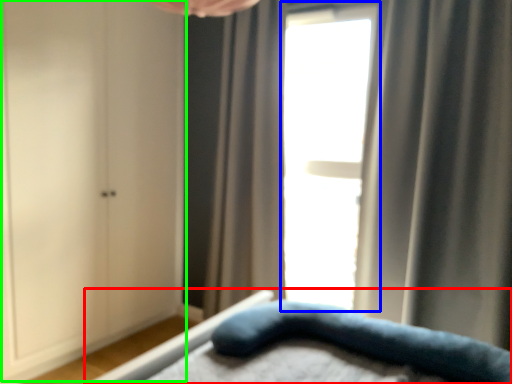
Question: Which is nearer to the bed (highlighted by a red box)? window (highlighted by a blue box) or dresser (highlighted by a green box).

Choices:
 (A) window
 (B) dresser

Answer: (A)